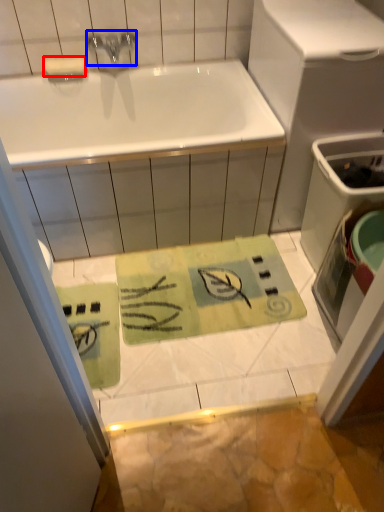
Question: Which object appears farthest to the camera in this image, soap (highlighted by a red box) or tap (highlighted by a blue box)?

Choices:
 (A) soap
 (B) tap

Answer: (A)